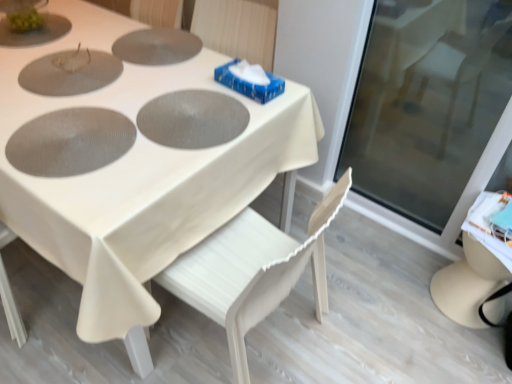
You are a GUI agent. You are given a task and a screenshot of the screen. Output one action in this format:
    pyautogui.click(x=<x>, y=<y>)
    Task: Click on the vacant space positioned to the left of matte gray pizza pan at upper center, the 1th pizza pan when ordered from back to front
    This screenshot has width=512, height=384.
    Given the screenshot: What is the action you would take?
    pyautogui.click(x=81, y=29)